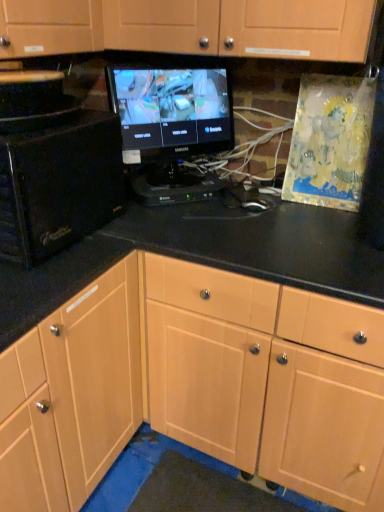
Question: Considering the positions of black glossy monitor at center and light wood cabinet at center in the image, is black glossy monitor at center taller or shorter than light wood cabinet at center?

Choices:
 (A) tall
 (B) short

Answer: (B)

Question: Considering their positions, is black glossy monitor at center located in front of or behind light wood cabinet at center?

Choices:
 (A) front
 (B) behind

Answer: (B)

Question: Estimate the real-world distances between objects in this image. Which object is closer to the black glossy microwave at left?

Choices:
 (A) black glossy monitor at center
 (B) light wood cabinet at center

Answer: (A)

Question: Estimate the real-world distances between objects in this image. Which object is closer to the black glossy monitor at center?

Choices:
 (A) light wood cabinet at center
 (B) black glossy microwave at left

Answer: (B)